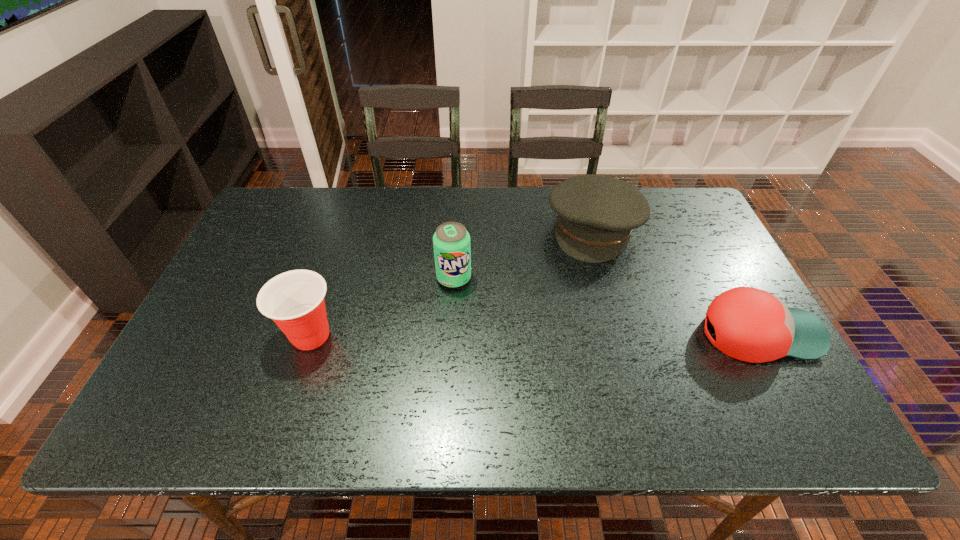
Find the location of a particular element. vacant space that's between the third object from left to right and the second object from left to right is located at coordinates (524, 253).

Locate an element on the screen. vacant area that lies between the cup and the shortest object is located at coordinates (535, 334).

The image size is (960, 540). What are the coordinates of `free space between the cup and the baseball cap` in the screenshot? It's located at (535, 334).

Identify which object is the third nearest to the leftmost object. Please provide its 2D coordinates. Your answer should be formatted as a tuple, i.e. [(x, y)], where the tuple contains the x and y coordinates of a point satisfying the conditions above.

[(752, 325)]

Identify the location of object that is the third closest to the rightmost object. Image resolution: width=960 pixels, height=540 pixels. (294, 300).

The height and width of the screenshot is (540, 960). In order to click on vacant space that satisfies the following two spatial constraints: 1. on the back side of the baseball cap; 2. at the brim of the leftmost object in this screenshot , I will do click(x=311, y=334).